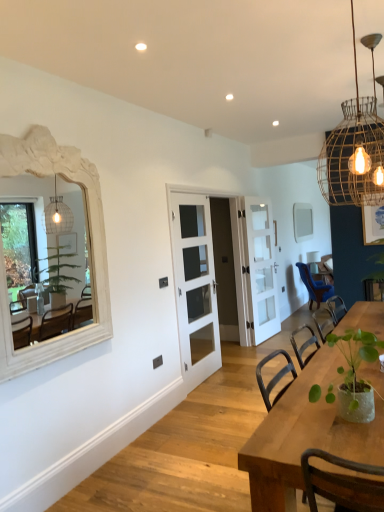
Question: Is point (97, 301) positioned closer to the camera than point (210, 286)?

Choices:
 (A) closer
 (B) farther

Answer: (A)

Question: From a real-world perspective, is white carved wood mirror at left, arranged as the first mirror when viewed from the front, above or below white glass door at center, the 2th door viewed from the front?

Choices:
 (A) above
 (B) below

Answer: (A)

Question: Estimate the real-world distances between objects in this image. Which object is farther from the green matte plant at lower right?

Choices:
 (A) blue velvet chair at right
 (B) bamboo wire chandelier at upper right
 (C) white matte mirror at upper center, the first mirror from the right
 (D) white carved wood mirror at left, the 1th mirror when ordered from left to right
 (E) white glass door at center, the first door positioned from the front

Answer: (C)

Question: Which object is the closest to the wooden table at center?

Choices:
 (A) white matte mirror at upper center, the 2th mirror in the left-to-right sequence
 (B) blue velvet chair at right
 (C) bamboo wire chandelier at upper right
 (D) white glossy door at center, which appears as the first door when viewed from the back
 (E) white glass door at center, the 3th door positioned from the back

Answer: (C)